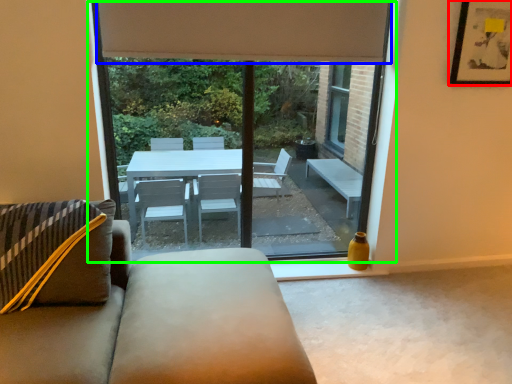
Question: Based on their relative distances, which object is nearer to picture frame (highlighted by a red box)? Choose from curtain (highlighted by a blue box) and window (highlighted by a green box).

Choices:
 (A) curtain
 (B) window

Answer: (A)